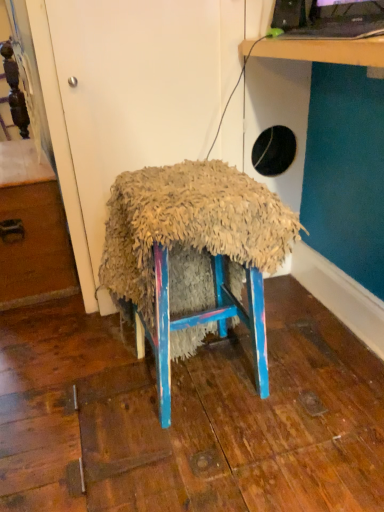
Question: Is wooden drawer at left in front of or behind black glossy desktop computer at upper right in the image?

Choices:
 (A) front
 (B) behind

Answer: (B)

Question: Considering the positions of point (29, 200) and point (352, 16), is point (29, 200) closer or farther from the camera than point (352, 16)?

Choices:
 (A) closer
 (B) farther

Answer: (B)

Question: Estimate the real-world distances between objects in this image. Which object is closer to the black glossy desktop computer at upper right?

Choices:
 (A) fuzzy fabric stool at center
 (B) wooden table at upper right
 (C) wooden drawer at left

Answer: (B)

Question: Estimate the real-world distances between objects in this image. Which object is farther from the wooden table at upper right?

Choices:
 (A) wooden drawer at left
 (B) fuzzy fabric stool at center
 (C) black glossy desktop computer at upper right

Answer: (A)